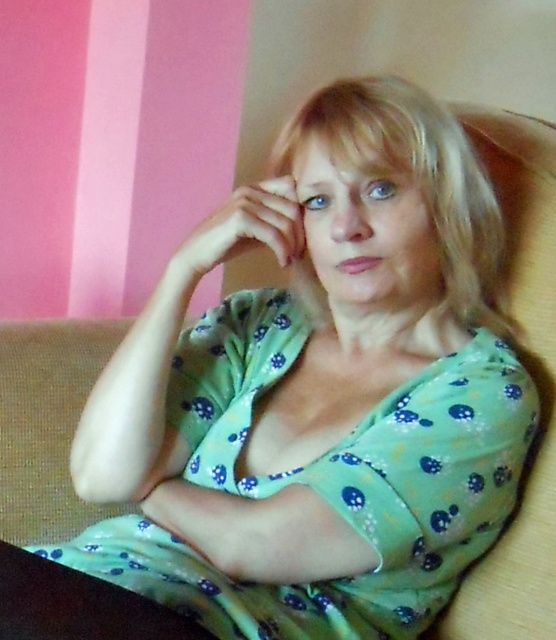
Question: Which point is closer to the camera taking this photo?

Choices:
 (A) click(191, 278)
 (B) click(418, 438)
 (C) click(459, 291)

Answer: (B)

Question: Among these points, which one is nearest to the camera?

Choices:
 (A) (265, 186)
 (B) (286, 150)

Answer: (A)

Question: Is blonde smooth hair at center wider than matte green hand at center?

Choices:
 (A) yes
 (B) no

Answer: (A)

Question: Where is green dotted fabric dress at center located in relation to blonde smooth hair at center in the image?

Choices:
 (A) below
 (B) above

Answer: (A)

Question: Is green dotted fabric dress at center bigger than matte green hand at center?

Choices:
 (A) yes
 (B) no

Answer: (A)

Question: Which of the following is the closest to the observer?

Choices:
 (A) (368, 96)
 (B) (230, 387)

Answer: (A)